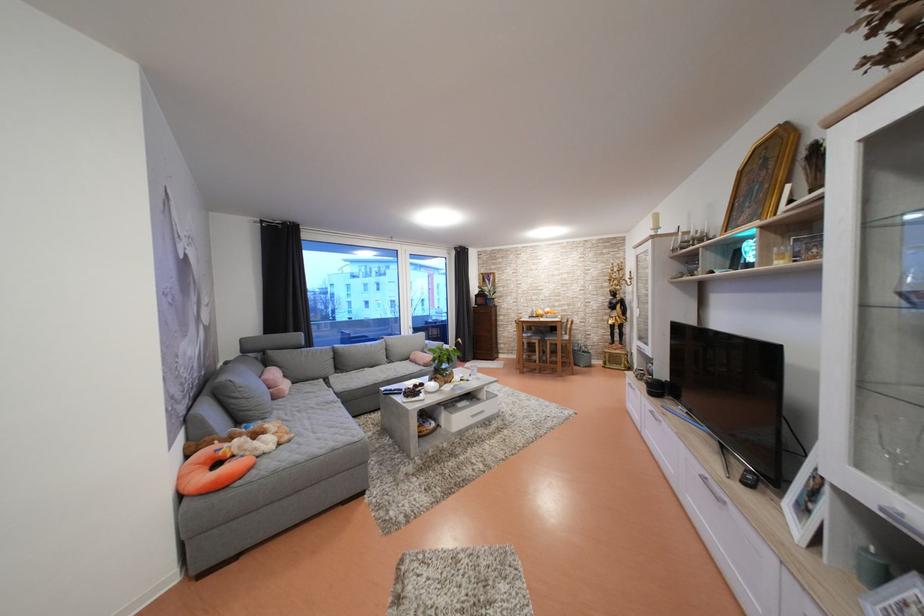
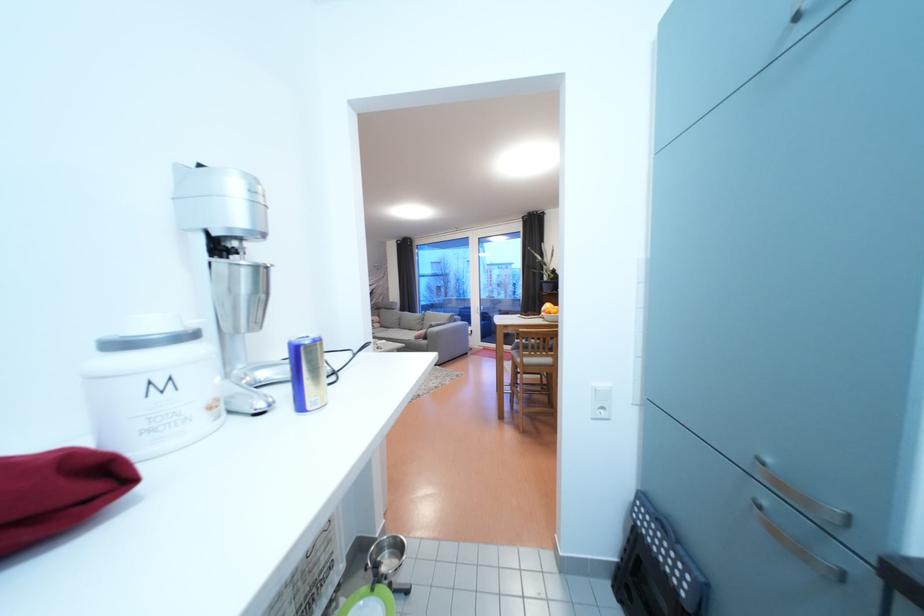
Question: I am providing you with two images of the same scene from different viewpoints. Which of the following objects are not visible in image2?

Choices:
 (A) whiteboard caster wheel
 (B) chair sitting surface
 (C) metal scoop
 (D) orange fruit

Answer: (B)